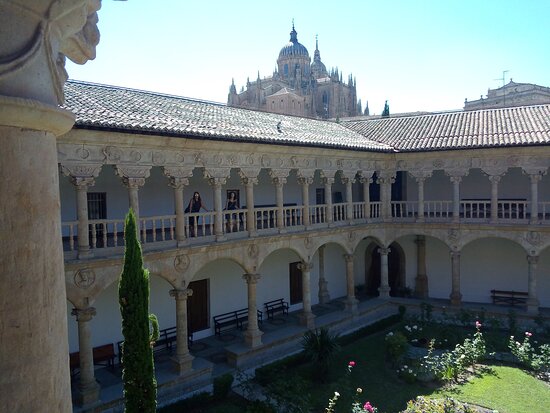
You are a GUI agent. You are given a task and a screenshot of the screen. Output one action in this format:
    pyautogui.click(x=<x>, y=<y>)
    Task: Click on the you sit on this bench to relax
    
    Given the screenshot: What is the action you would take?
    pyautogui.click(x=166, y=336), pyautogui.click(x=234, y=320), pyautogui.click(x=275, y=310), pyautogui.click(x=500, y=296)